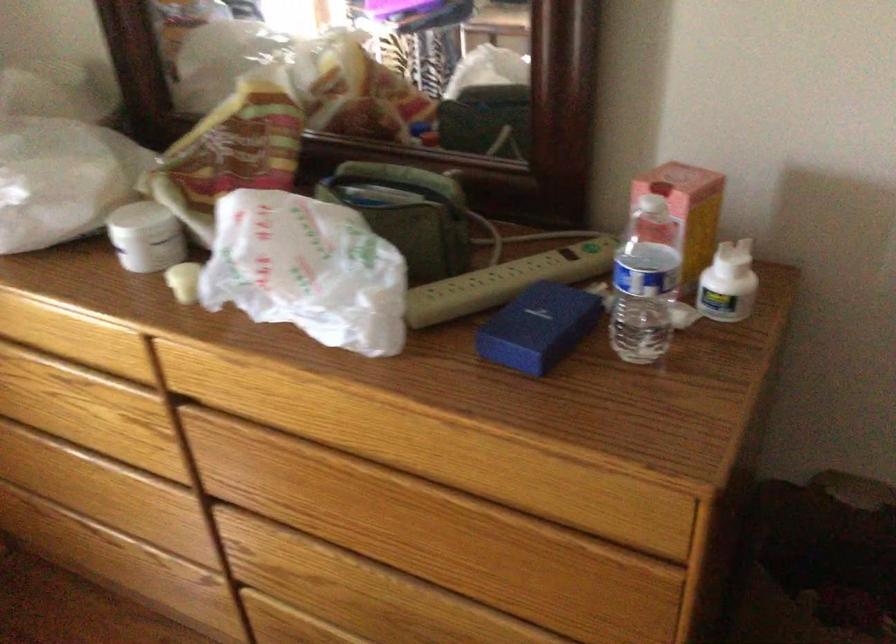
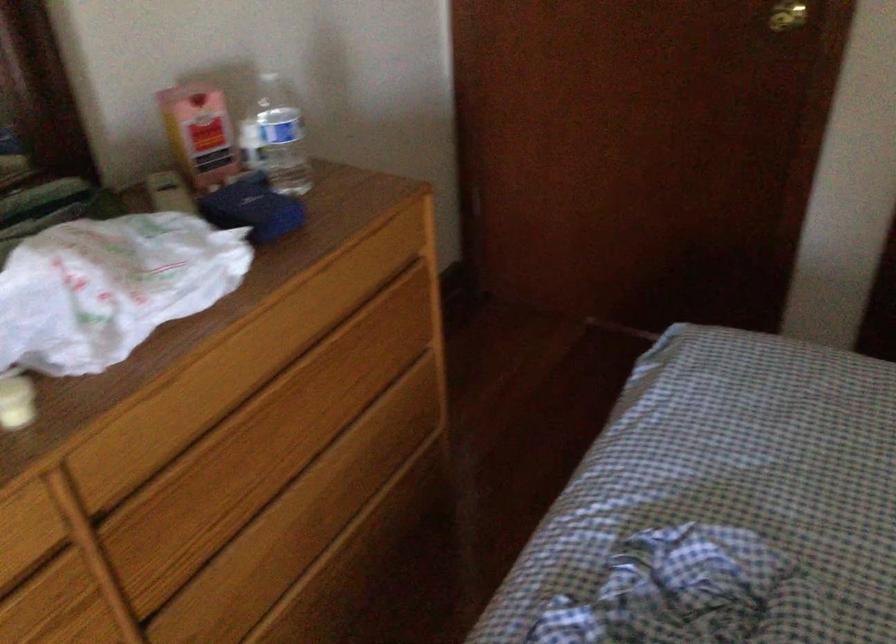
The point at (339, 507) is marked in the first image. Where is the corresponding point in the second image?

(263, 456)